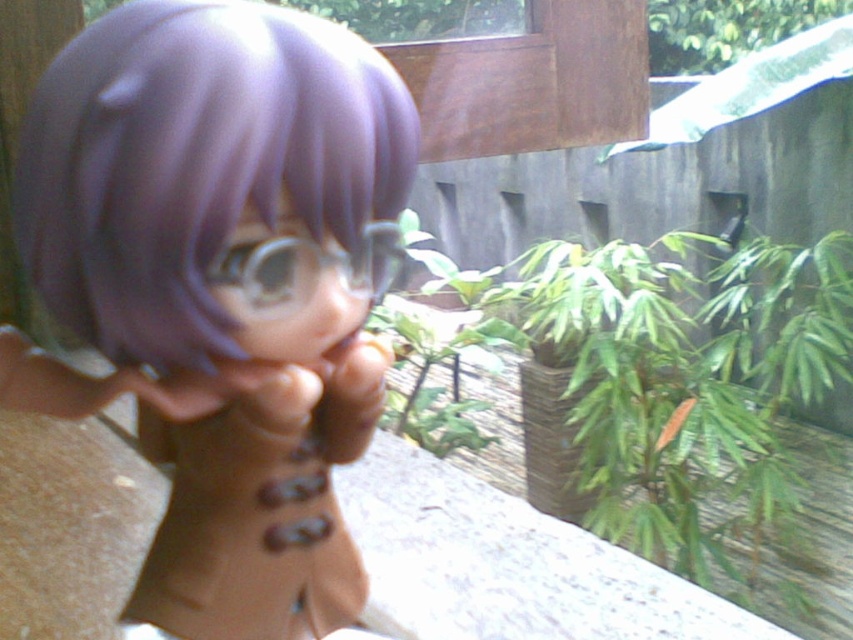
Between matte purple doll at center and green leafy plant at center, which one has more height?

Standing taller between the two is green leafy plant at center.

Does point (184, 236) come in front of point (648, 381)?

That is True.

At what (x,y) coordinates should I click in order to perform the action: click on matte purple doll at center. Please return your answer as a coordinate pair (x, y). The image size is (853, 640). Looking at the image, I should click on (219, 289).

Locate an element on the screen. matte purple doll at center is located at coordinates (219, 289).

Who is lower down, matte purple doll at center or green leafy plant at upper right?

Positioned lower is matte purple doll at center.

Is point (201, 426) positioned before point (746, 19)?

Yes, point (201, 426) is closer to viewer.

Where is `matte purple doll at center`? matte purple doll at center is located at coordinates (219, 289).

Looking at this image, can you confirm if green leafy plant at center is positioned below green leafy plant at upper right?

Correct, green leafy plant at center is located below green leafy plant at upper right.

Is point (683, 420) farther from viewer compared to point (813, 10)?

No, (683, 420) is closer to viewer.

I want to click on green leafy plant at center, so click(668, 428).

I want to click on green leafy plant at center, so click(668, 428).